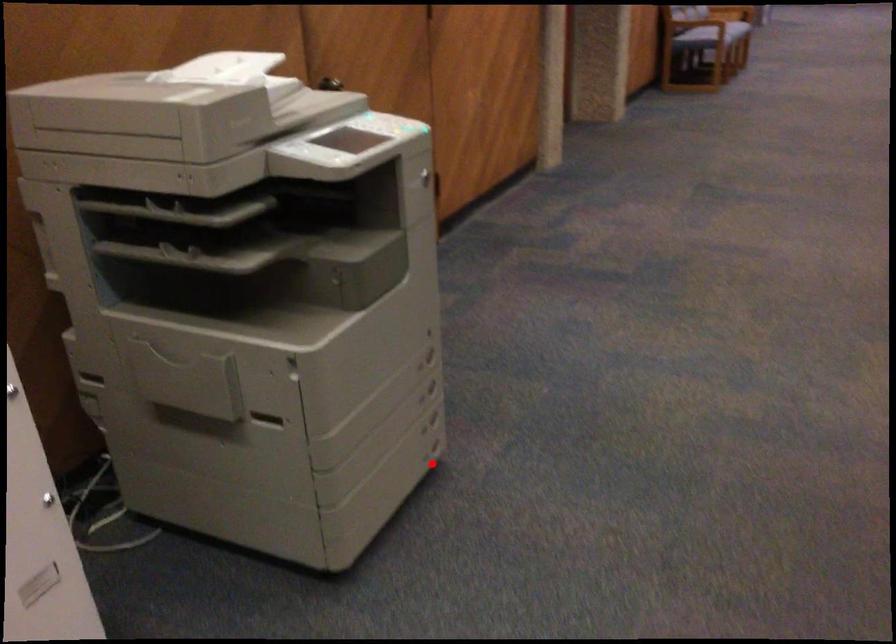
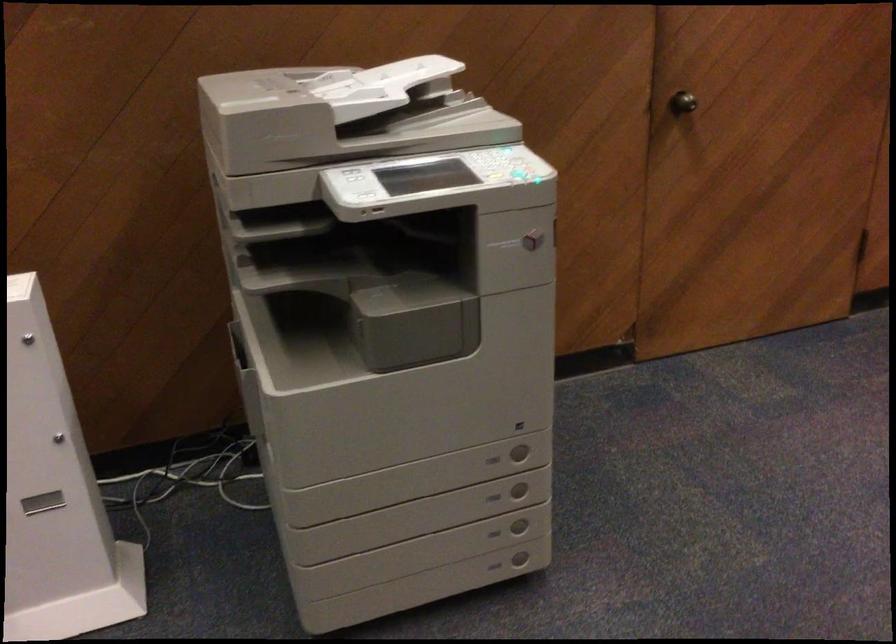
The point at the highlighted location is marked in the first image. Where is the corresponding point in the second image?

(494, 567)